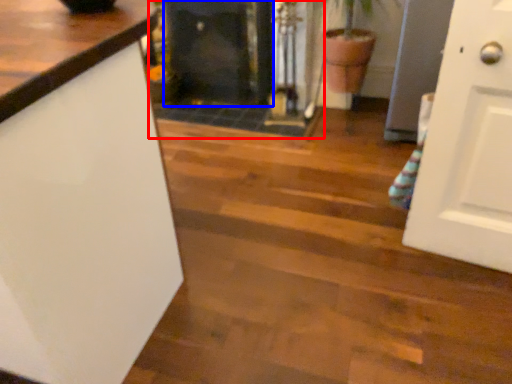
Question: Which object appears farthest to the camera in this image, fireplace (highlighted by a red box) or fireplace (highlighted by a blue box)?

Choices:
 (A) fireplace
 (B) fireplace

Answer: (B)